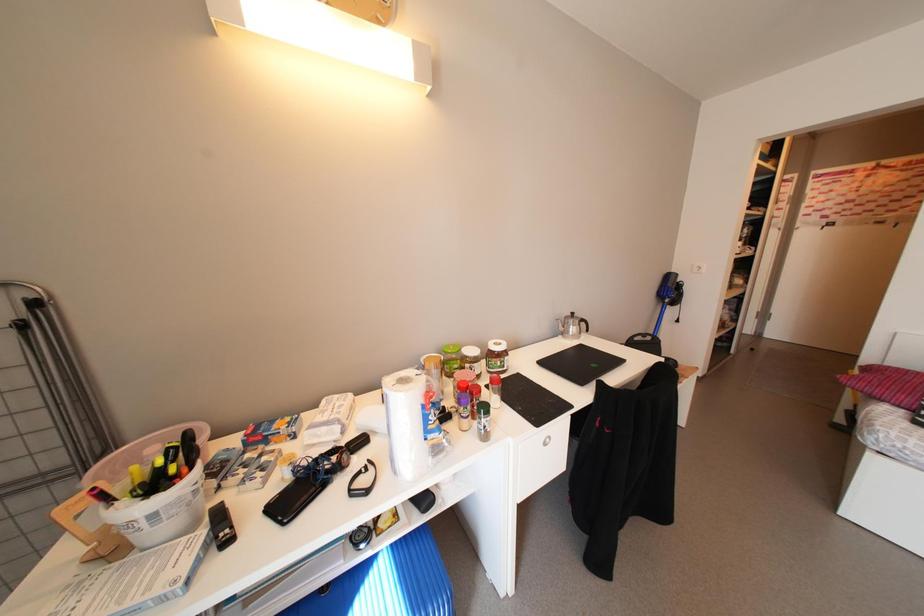
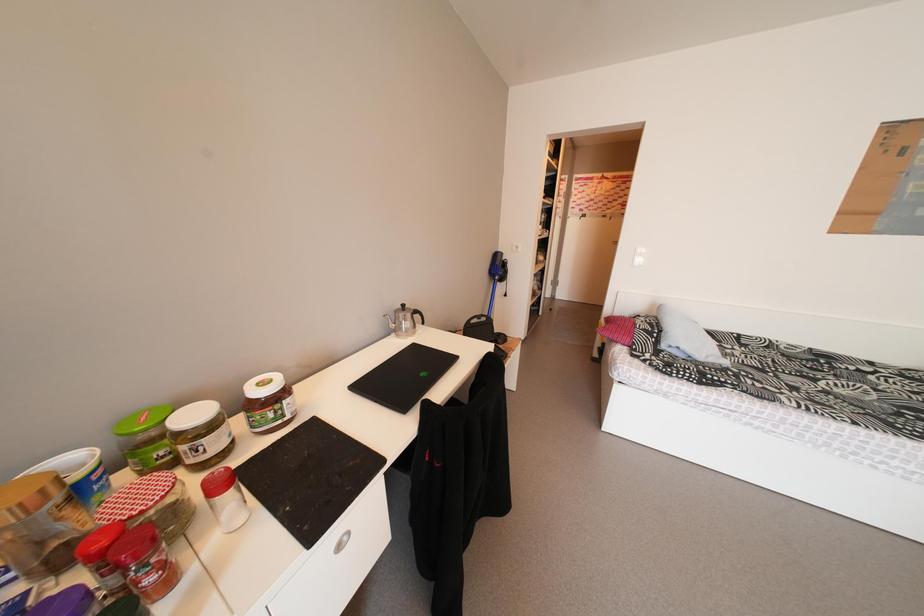
Question: The first image is from the beginning of the video and the second image is from the end. How did the camera likely rotate when shooting the video?

Choices:
 (A) Left
 (B) Right
 (C) Up
 (D) Down

Answer: (B)